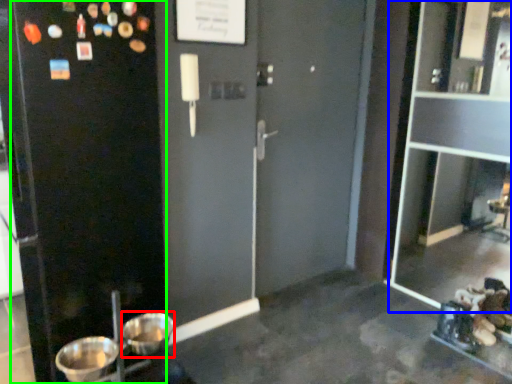
Question: Which object is positioned farthest from basin (highlighted by a red box)? Select from glass door (highlighted by a blue box) and screen door (highlighted by a green box).

Choices:
 (A) glass door
 (B) screen door

Answer: (A)